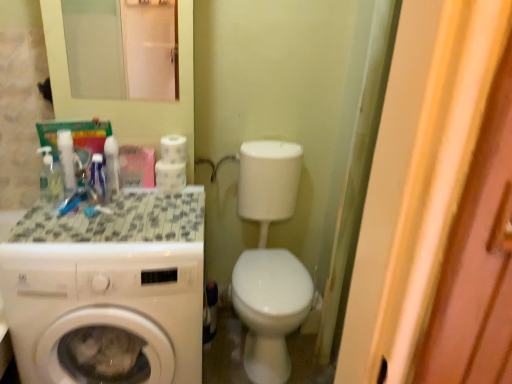
Find the location of a particular element. The image size is (512, 384). vacant space to the right of white glossy mouthwash at upper left, placed as the 1th mouthwash when sorted from right to left is located at coordinates (151, 198).